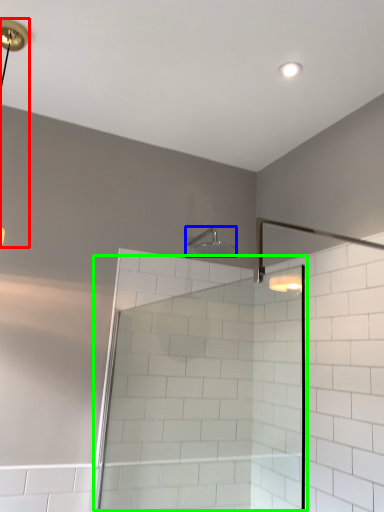
Question: Estimate the real-world distances between objects in this image. Which object is farther from lamp (highlighted by a red box), shower (highlighted by a blue box) or screen door (highlighted by a green box)?

Choices:
 (A) shower
 (B) screen door

Answer: (B)